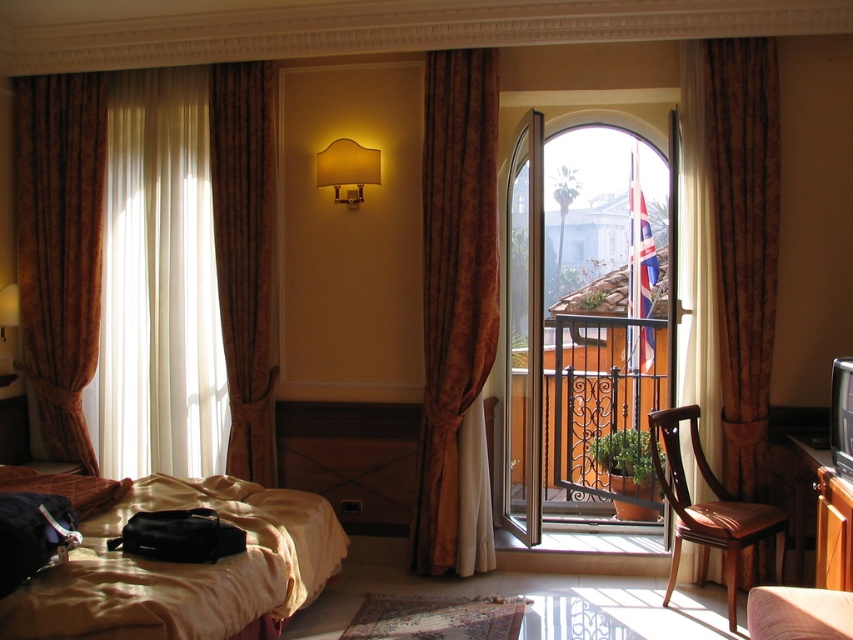
The image size is (853, 640). Find the location of `gold textured curtain at left`. gold textured curtain at left is located at coordinates (59, 248).

Between gold textured curtain at left and brown textured curtain at left, which one has more height?

brown textured curtain at left

Who is more distant from viewer, (41, 275) or (271, 134)?

The point (41, 275) is behind.

Where is `gold textured curtain at left`? This screenshot has height=640, width=853. gold textured curtain at left is located at coordinates (59, 248).

Who is positioned more to the left, clear glass door at center or transparent glass table at lower center?

From the viewer's perspective, transparent glass table at lower center appears more on the left side.

Consider the image. Is clear glass door at center below transparent glass table at lower center?

Incorrect, clear glass door at center is not positioned below transparent glass table at lower center.

Locate an element on the screen. The image size is (853, 640). clear glass door at center is located at coordinates coord(584,330).

Is gold textured curtain at left positioned at the back of transparent glass table at lower center?

Yes, it is.

Between gold textured curtain at left and transparent glass table at lower center, which one is positioned higher?

gold textured curtain at left is higher up.

Describe the element at coordinates (59, 248) in the screenshot. I see `gold textured curtain at left` at that location.

This screenshot has height=640, width=853. In order to click on gold textured curtain at left in this screenshot , I will do `click(59, 248)`.